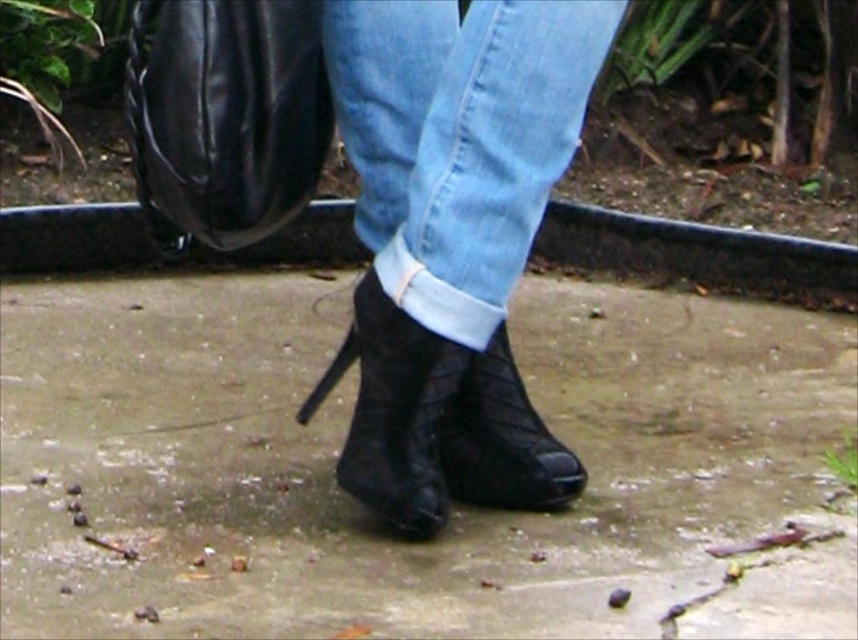
You are a delivery robot that needs to place a package on the slate gray concrete at center. However, there is a black quilted boot at center in the way. Can you move the boot to the side to make space?

The slate gray concrete at center has a larger size compared to black quilted boot at center, so yes, you can move the black quilted boot at center to the side and still have enough space on the slate gray concrete at center to place the package.

You are standing at the point labeled point [400,499] and want to walk to the point labeled point [669,529]. Given the scene described, will you need to step onto the garden area to reach your destination?

Point [669,529] is behind point [400,499], so you would need to step onto the garden area to reach it since the path behind might be the garden separated by the curb.

You are a delivery person trying to place a package on the ground. The package is too heavy to lift, so you need to slide it from the black suede boot at center to the slate gray concrete at center. Can you slide the package directly without moving it around?

The slate gray concrete at center is to the right of black suede boot at center, so yes, you can slide the package directly to the right from the black suede boot at center to the slate gray concrete at center.